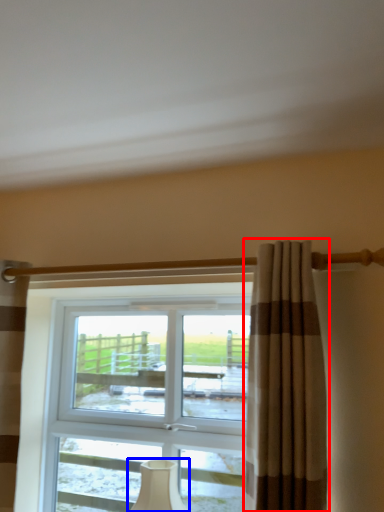
Question: Among these objects, which one is nearest to the camera, curtain (highlighted by a red box) or table lamp (highlighted by a blue box)?

Choices:
 (A) curtain
 (B) table lamp

Answer: (A)